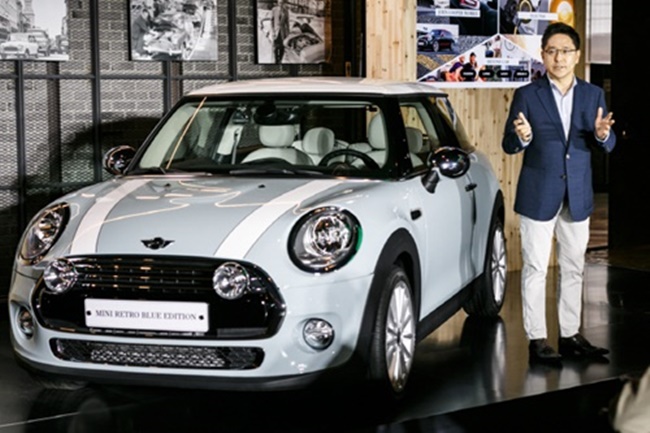
You are a GUI agent. You are given a task and a screenshot of the screen. Output one action in this format:
    pyautogui.click(x=<x>, y=<y>)
    Task: Click on the dark and light gray brick wall
    This screenshot has width=650, height=433.
    Given the screenshot: What is the action you would take?
    pyautogui.click(x=112, y=58)